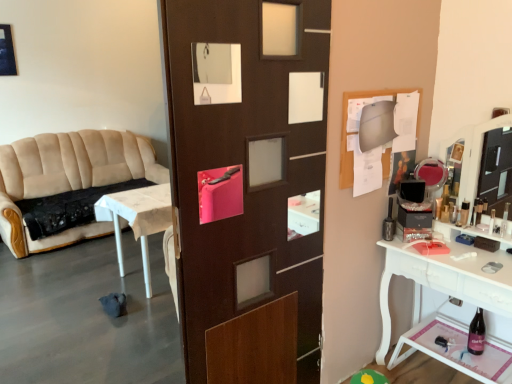
In order to click on clear plastic bottle at right, placed as the first toiletry when sorted from front to back in this screenshot , I will do `click(492, 221)`.

The image size is (512, 384). Identify the location of metallic silver toiletry at right, which is the 1th toiletry from left to right. (464, 213).

From a real-world perspective, is clear plastic bottle at right, placed as the first toiletry when sorted from front to back, located higher than metallic silver toiletry at right, which is the second toiletry in right-to-left order?

Actually, clear plastic bottle at right, placed as the first toiletry when sorted from front to back, is physically below metallic silver toiletry at right, which is the second toiletry in right-to-left order, in the real world.

The width and height of the screenshot is (512, 384). I want to click on toiletry above the clear plastic bottle at right, which ranks as the first toiletry in right-to-left order (from a real-world perspective), so click(464, 213).

How far apart are clear plastic bottle at right, positioned as the second toiletry in back-to-front order, and metallic silver toiletry at right, which is the second toiletry in right-to-left order?

They are 4.77 inches apart.

How many degrees apart are the facing directions of clear plastic bottle at right, placed as the first toiletry when sorted from front to back, and metallic silver toiletry at right, arranged as the first toiletry when viewed from the back?

They differ by 4.07 degrees in their facing directions.

In the image, there is a metallic silver toiletry at right, which is the second toiletry in right-to-left order. At what (x,y) coordinates should I click in order to perform the action: click on studio couch above it (from the image's perspective). Please return your answer as a coordinate pair (x, y). The height and width of the screenshot is (384, 512). Looking at the image, I should click on (68, 178).

From the image's perspective, which one is positioned lower, beige fabric couch at left or metallic silver toiletry at right, arranged as the first toiletry when viewed from the back?

metallic silver toiletry at right, arranged as the first toiletry when viewed from the back.

Between point (66, 241) and point (463, 204), which one is positioned behind?

The point (66, 241) is farther.

Is beige fabric couch at left in front of or behind metallic silver toiletry at right, which is the second toiletry in right-to-left order, in the image?

beige fabric couch at left is positioned farther from the viewer than metallic silver toiletry at right, which is the second toiletry in right-to-left order.

Is clear plastic bottle at right, placed as the first toiletry when sorted from front to back, inside metallic silver toiletry at right, which is the second toiletry in right-to-left order?

No, clear plastic bottle at right, placed as the first toiletry when sorted from front to back, is not a part of metallic silver toiletry at right, which is the second toiletry in right-to-left order.

From the image's perspective, is metallic silver toiletry at right, arranged as the first toiletry when viewed from the back, above or below clear plastic bottle at right, positioned as the second toiletry in back-to-front order?

metallic silver toiletry at right, arranged as the first toiletry when viewed from the back, is above clear plastic bottle at right, positioned as the second toiletry in back-to-front order.

Can you tell me how much metallic silver toiletry at right, arranged as the first toiletry when viewed from the back, and clear plastic bottle at right, positioned as the second toiletry in back-to-front order, differ in facing direction?

They differ by 4.07 degrees in their facing directions.

Considering the points (467, 216) and (490, 233), which point is in front, point (467, 216) or point (490, 233)?

The point (490, 233) is more forward.

Can clear plastic bottle at right, positioned as the second toiletry in back-to-front order, be found inside beige fabric couch at left?

That's incorrect, clear plastic bottle at right, positioned as the second toiletry in back-to-front order, is not inside beige fabric couch at left.

In the scene shown: From the image's perspective, is beige fabric couch at left located above clear plastic bottle at right, which ranks as the first toiletry in right-to-left order?

Yes.

Which is in front, point (123, 223) or point (490, 234)?

Positioned in front is point (490, 234).

Which object is more forward, metallic silver toiletry at right, the second toiletry when ordered from front to back, or beige fabric couch at left?

metallic silver toiletry at right, the second toiletry when ordered from front to back, is closer to the camera.

Locate an element on the screen. studio couch behind the metallic silver toiletry at right, which is the 1th toiletry from left to right is located at coordinates (68, 178).

Is metallic silver toiletry at right, which is the 1th toiletry from left to right, in contact with beige fabric couch at left?

They are not placed beside each other.

Is clear plastic bottle at right, which ranks as the first toiletry in right-to-left order, facing away from beige fabric couch at left?

No, beige fabric couch at left is not at the back of clear plastic bottle at right, which ranks as the first toiletry in right-to-left order.

Measure the distance between clear plastic bottle at right, positioned as the second toiletry in back-to-front order, and beige fabric couch at left.

They are 13.46 feet apart.

Is clear plastic bottle at right, which ranks as the first toiletry in right-to-left order, spatially inside beige fabric couch at left, or outside of it?

clear plastic bottle at right, which ranks as the first toiletry in right-to-left order, is not inside beige fabric couch at left, it's outside.

Where is `toiletry on the left of clear plastic bottle at right, which ranks as the first toiletry in right-to-left order`? This screenshot has width=512, height=384. toiletry on the left of clear plastic bottle at right, which ranks as the first toiletry in right-to-left order is located at coordinates (464, 213).

The height and width of the screenshot is (384, 512). Find the location of `the 1st toiletry in front when counting from the beige fabric couch at left`. the 1st toiletry in front when counting from the beige fabric couch at left is located at coordinates (464, 213).

Estimate the real-world distances between objects in this image. Which object is further from clear plastic bottle at right, positioned as the second toiletry in back-to-front order, metallic silver toiletry at right, which is the second toiletry in right-to-left order, or beige fabric couch at left?

Among the two, beige fabric couch at left is located further to clear plastic bottle at right, positioned as the second toiletry in back-to-front order.

When comparing their distances from beige fabric couch at left, does clear plastic bottle at right, placed as the first toiletry when sorted from front to back, or metallic silver toiletry at right, the second toiletry when ordered from front to back, seem closer?

Among the two, metallic silver toiletry at right, the second toiletry when ordered from front to back, is located nearer to beige fabric couch at left.

Looking at the image, which one is located closer to metallic silver toiletry at right, arranged as the first toiletry when viewed from the back, beige fabric couch at left or clear plastic bottle at right, placed as the first toiletry when sorted from front to back?

Based on the image, clear plastic bottle at right, placed as the first toiletry when sorted from front to back, appears to be nearer to metallic silver toiletry at right, arranged as the first toiletry when viewed from the back.

Looking at the image, which one is located further to clear plastic bottle at right, which ranks as the first toiletry in right-to-left order, beige fabric couch at left or metallic silver toiletry at right, the second toiletry when ordered from front to back?

beige fabric couch at left lies further to clear plastic bottle at right, which ranks as the first toiletry in right-to-left order, than the other object.

Based on their spatial positions, is metallic silver toiletry at right, the second toiletry when ordered from front to back, or clear plastic bottle at right, placed as the first toiletry when sorted from front to back, further from beige fabric couch at left?

Based on the image, clear plastic bottle at right, placed as the first toiletry when sorted from front to back, appears to be further to beige fabric couch at left.

Based on their spatial positions, is clear plastic bottle at right, positioned as the second toiletry in back-to-front order, or beige fabric couch at left further from metallic silver toiletry at right, arranged as the first toiletry when viewed from the back?

The object further to metallic silver toiletry at right, arranged as the first toiletry when viewed from the back, is beige fabric couch at left.

I want to click on toiletry between beige fabric couch at left and clear plastic bottle at right, which ranks as the first toiletry in right-to-left order, so click(x=464, y=213).